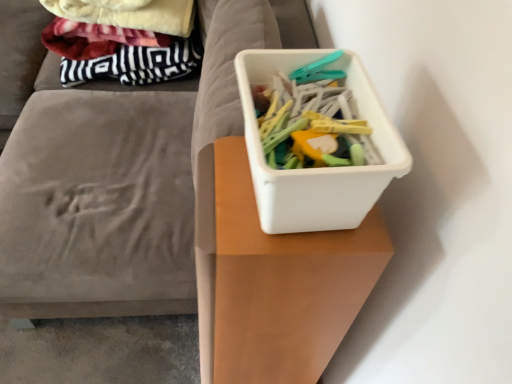
Question: Is the surface of white plastic container at center in direct contact with white plastic container at upper right?

Choices:
 (A) yes
 (B) no

Answer: (B)

Question: From a real-world perspective, is white plastic container at center under white plastic container at upper right?

Choices:
 (A) yes
 (B) no

Answer: (B)

Question: From the image's perspective, does white plastic container at center appear higher than white plastic container at upper right?

Choices:
 (A) yes
 (B) no

Answer: (A)

Question: Considering the relative sizes of white plastic container at center and white plastic container at upper right in the image provided, is white plastic container at center smaller than white plastic container at upper right?

Choices:
 (A) no
 (B) yes

Answer: (B)

Question: Could white plastic container at upper right be considered to be inside white plastic container at center?

Choices:
 (A) yes
 (B) no

Answer: (B)

Question: Is white plastic container at center not near white plastic container at upper right?

Choices:
 (A) yes
 (B) no

Answer: (B)

Question: Is white plastic container at upper right positioned beyond the bounds of white plastic container at center?

Choices:
 (A) no
 (B) yes

Answer: (B)

Question: Considering the relative sizes of white plastic container at upper right and white plastic container at center in the image provided, is white plastic container at upper right bigger than white plastic container at center?

Choices:
 (A) yes
 (B) no

Answer: (A)

Question: Are white plastic container at upper right and white plastic container at center located far from each other?

Choices:
 (A) yes
 (B) no

Answer: (B)

Question: Could white plastic container at center be considered to be inside white plastic container at upper right?

Choices:
 (A) yes
 (B) no

Answer: (B)

Question: From the image's perspective, does white plastic container at upper right appear higher than white plastic container at center?

Choices:
 (A) no
 (B) yes

Answer: (A)

Question: Does white plastic container at upper right have a greater width compared to white plastic container at center?

Choices:
 (A) yes
 (B) no

Answer: (A)

Question: Is the position of white plastic container at center more distant than that of white plastic container at upper right?

Choices:
 (A) yes
 (B) no

Answer: (A)